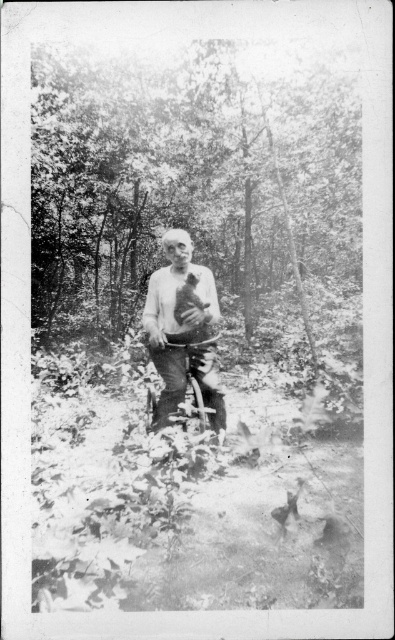
Question: Among these points, which one is nearest to the camera?

Choices:
 (A) (210, 378)
 (B) (338, 122)

Answer: (A)

Question: Is the position of smooth bark tree at center more distant than that of smooth white shirt at center?

Choices:
 (A) yes
 (B) no

Answer: (A)

Question: Is smooth bark tree at center closer to camera compared to smooth white shirt at center?

Choices:
 (A) no
 (B) yes

Answer: (A)

Question: Which point is closer to the camera taking this photo?

Choices:
 (A) (165, 397)
 (B) (227, 58)

Answer: (A)

Question: Does smooth bark tree at center appear over smooth white shirt at center?

Choices:
 (A) yes
 (B) no

Answer: (A)

Question: Among these objects, which one is farthest from the camera?

Choices:
 (A) smooth white shirt at center
 (B) smooth bark tree at center

Answer: (B)